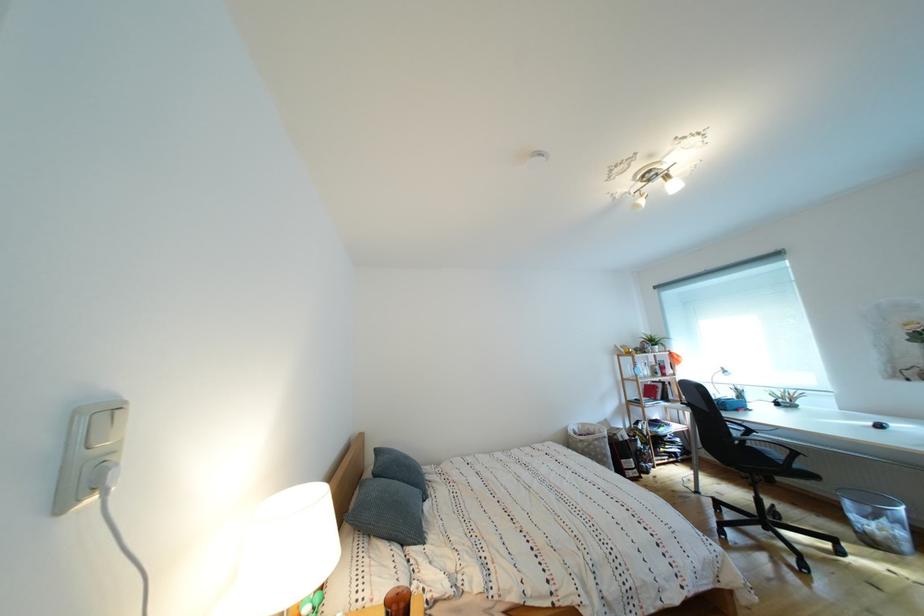
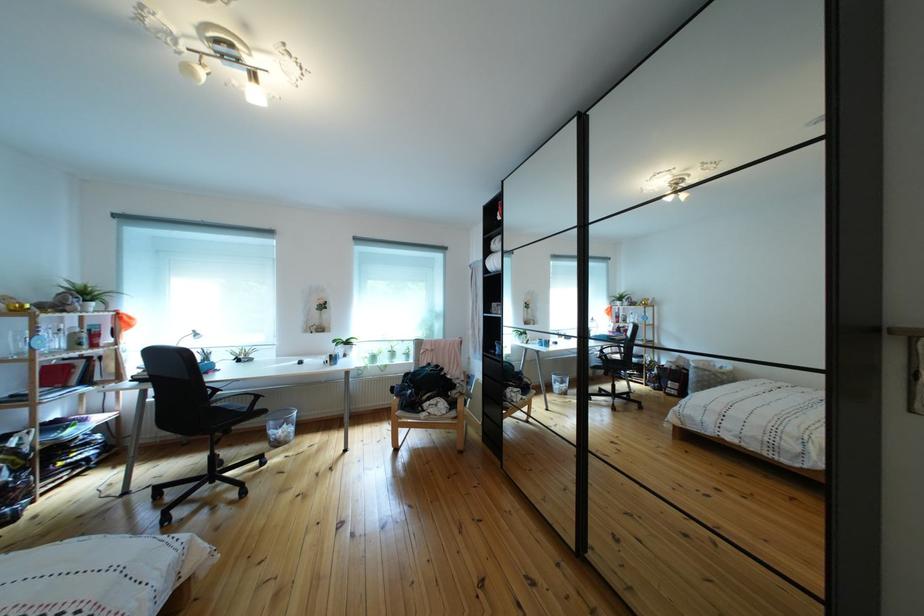
The point at (858,509) is marked in the first image. Where is the corresponding point in the second image?

(283, 430)